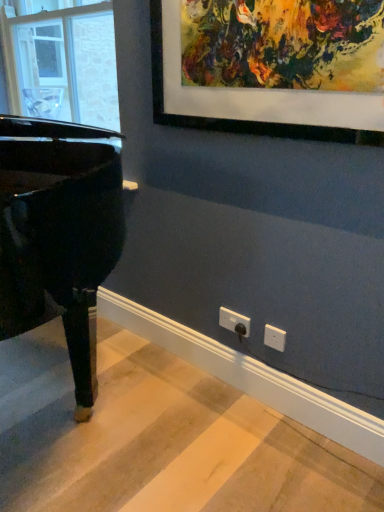
Question: Considering the positions of transparent glass window at left and glossy black piano at left in the image, is transparent glass window at left wider or thinner than glossy black piano at left?

Choices:
 (A) wide
 (B) thin

Answer: (B)

Question: Considering their positions, is transparent glass window at left located in front of or behind glossy black piano at left?

Choices:
 (A) behind
 (B) front

Answer: (A)

Question: Which object is the closest to the white plastic electric outlet at lower center?

Choices:
 (A) transparent glass window at left
 (B) glossy black piano at left

Answer: (B)

Question: Estimate the real-world distances between objects in this image. Which object is closer to the white plastic electric outlet at lower center?

Choices:
 (A) transparent glass window at left
 (B) glossy black piano at left

Answer: (B)